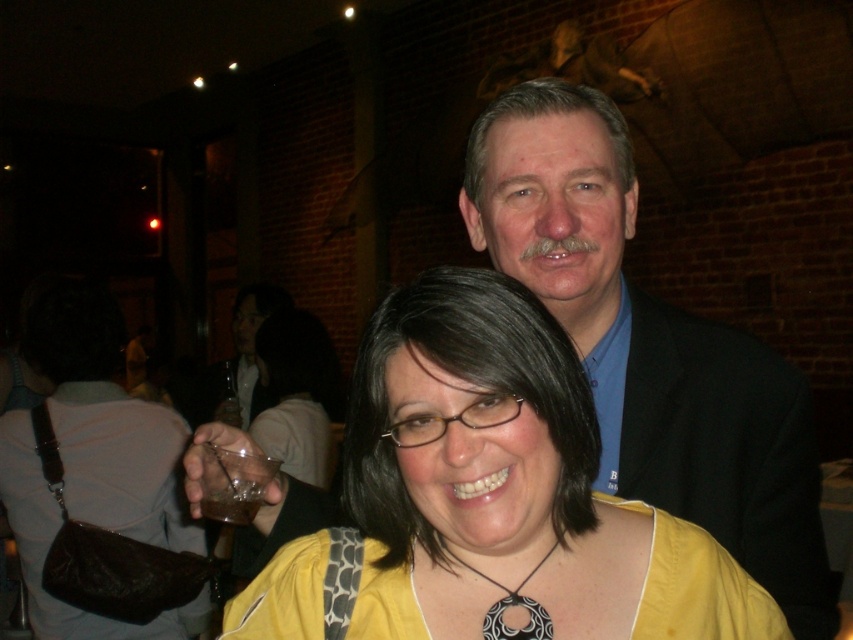
You are at a party and want to grab a drink. You see a translucent glass at center and a clear plastic cup at lower center. Which one is closer to you?

The clear plastic cup at lower center is closer to you because the translucent glass at center is positioned under it.

You are at a social gathering and see a clear plastic cup at lower center. There is a point marked at coordinates (233,483). Is this point located on the clear plastic cup?

Yes, the point at coordinates (233,483) is located on the clear plastic cup at lower center according to the description.

You are at a party and need to grab a drink. There are two cups in front of you. The clear plastic cup at lower center and the translucent plastic cup at lower left. Which cup is to the right of the other?

The clear plastic cup at lower center is positioned on the right side of the translucent plastic cup at lower left.